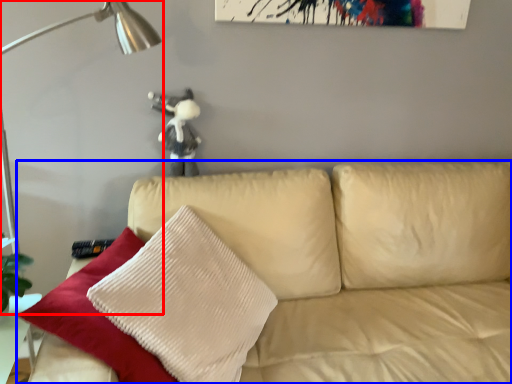
Question: Which point is further to the camera, table lamp (highlighted by a red box) or studio couch (highlighted by a blue box)?

Choices:
 (A) table lamp
 (B) studio couch

Answer: (A)